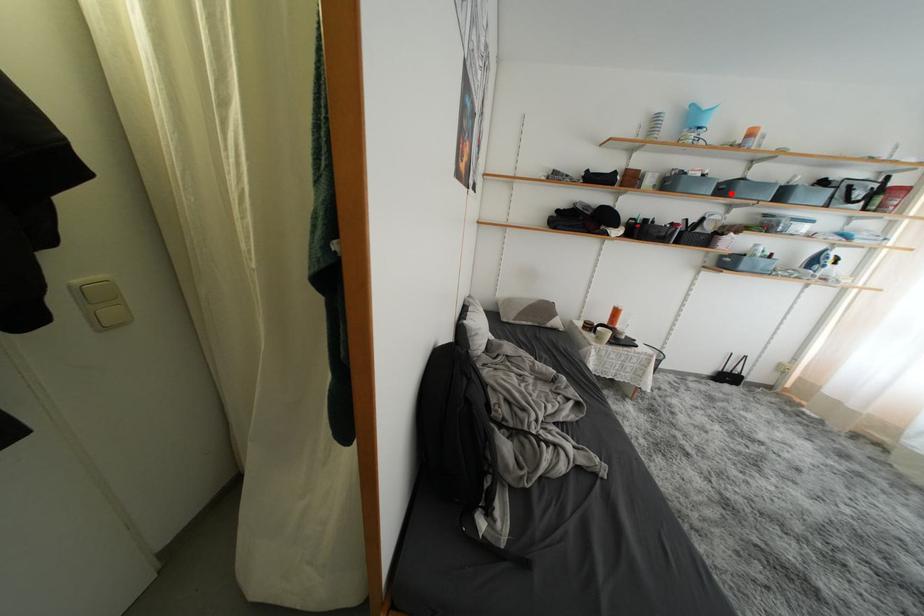
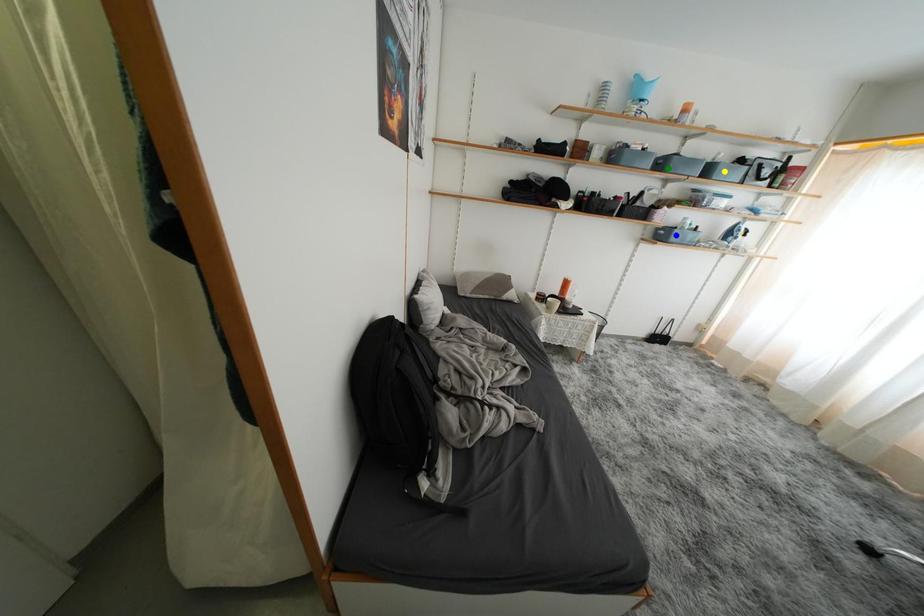
Question: I am providing you with two images of the same scene from different viewpoints. A red point is marked on the first image. You are given multiple points on the second image. Which point in image 2 represents the same 3d spot as the red point in image 1?

Choices:
 (A) blue point
 (B) yellow point
 (C) green point

Answer: (C)